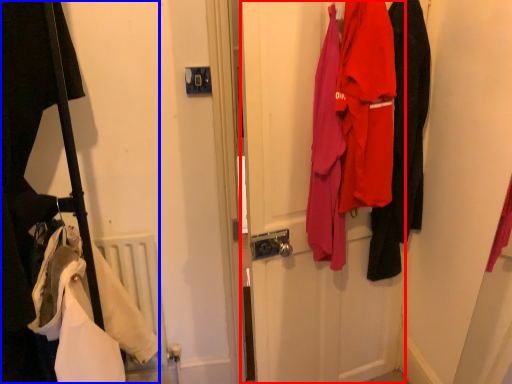
Question: Which object appears farthest to the camera in this image, door (highlighted by a red box) or closet (highlighted by a blue box)?

Choices:
 (A) door
 (B) closet

Answer: (A)